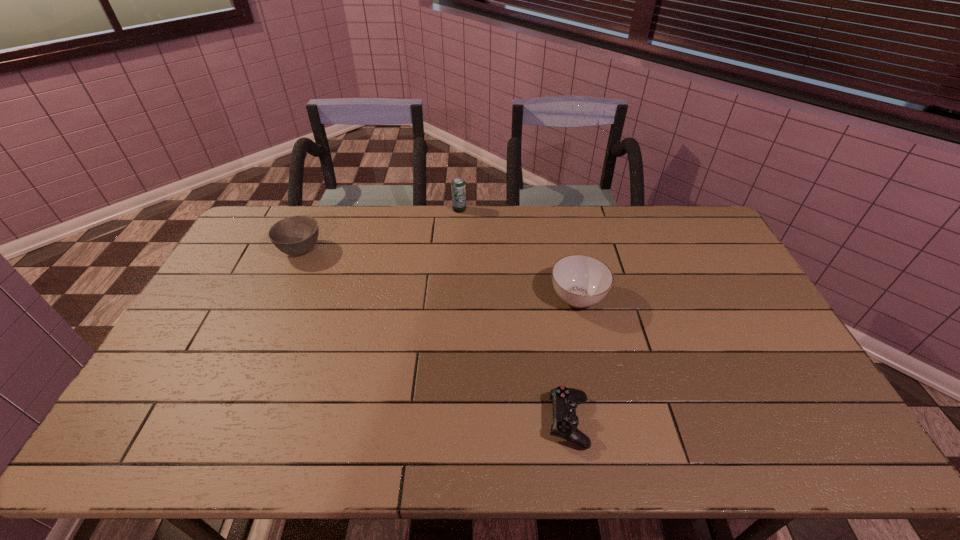
This screenshot has height=540, width=960. What are the coordinates of `object that ranks as the second closest to the chinaware` in the screenshot? It's located at (458, 187).

The width and height of the screenshot is (960, 540). Find the location of `object that is the second closest to the chinaware`. object that is the second closest to the chinaware is located at coordinates (458, 187).

This screenshot has width=960, height=540. What are the coordinates of `vacant area that satisfies the following two spatial constraints: 1. on the front side of the chinaware; 2. on the right side of the beer can` in the screenshot? It's located at (454, 298).

The width and height of the screenshot is (960, 540). Identify the location of free region that satisfies the following two spatial constraints: 1. on the front side of the tallest object; 2. on the right side of the shortest object. (447, 422).

You are a GUI agent. You are given a task and a screenshot of the screen. Output one action in this format:
    pyautogui.click(x=<x>, y=<y>)
    Task: Click on the vacant region that satisfies the following two spatial constraints: 1. on the back side of the nearest object; 2. on the left side of the chinaware
    The width and height of the screenshot is (960, 540).
    Given the screenshot: What is the action you would take?
    pyautogui.click(x=549, y=298)

I want to click on blank area in the image that satisfies the following two spatial constraints: 1. on the front side of the tallest object; 2. on the right side of the chinaware, so click(454, 298).

Where is `free space that satisfies the following two spatial constraints: 1. on the front side of the nearest object; 2. on the right side of the tallest object`? The image size is (960, 540). free space that satisfies the following two spatial constraints: 1. on the front side of the nearest object; 2. on the right side of the tallest object is located at coordinates (447, 422).

This screenshot has height=540, width=960. I want to click on free space that satisfies the following two spatial constraints: 1. on the front side of the beer can; 2. on the right side of the second nearest object, so click(454, 298).